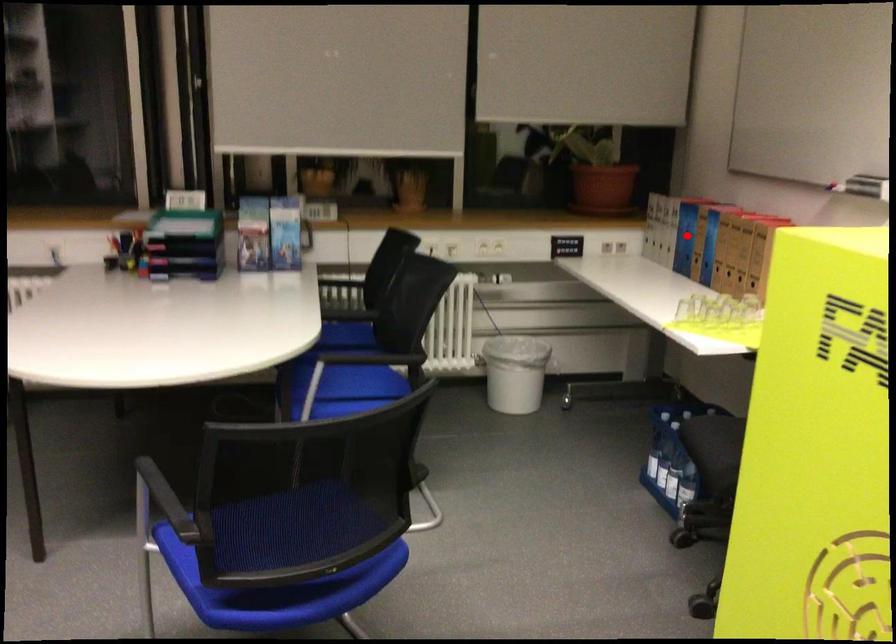
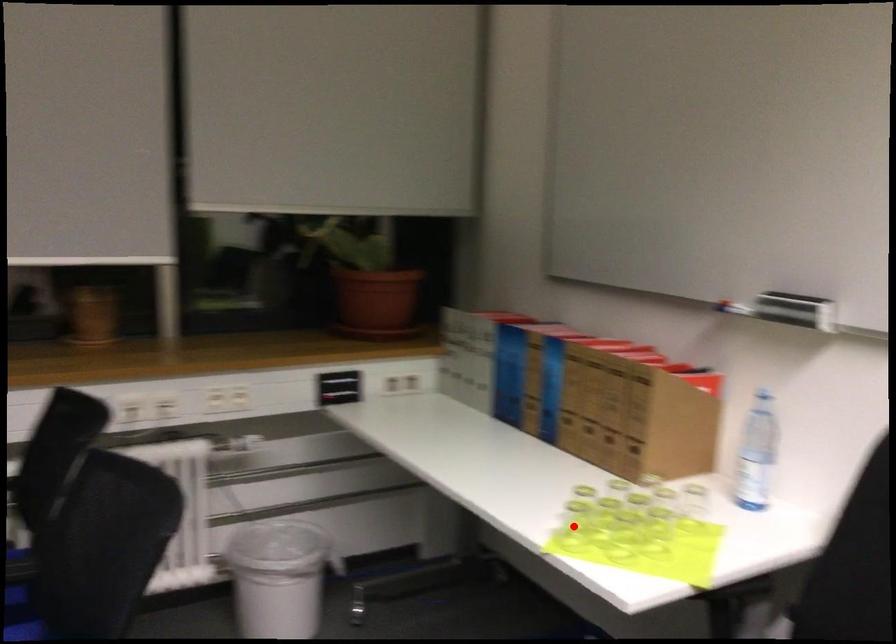
I am providing you with two images of the same scene from different viewpoints. A red point is marked on the first image and another point is marked on the second image. Do the highlighted points in image1 and image2 indicate the same real-world spot?

No